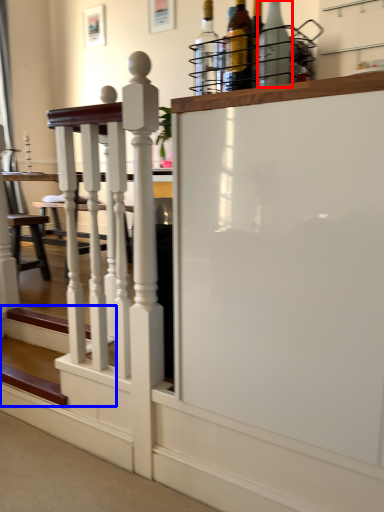
Question: Which of the following is the closest to the observer, bottle (highlighted by a red box) or stairs (highlighted by a blue box)?

Choices:
 (A) bottle
 (B) stairs

Answer: (A)